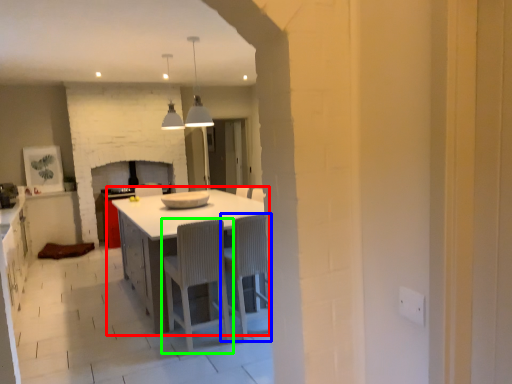
Question: Based on their relative distances, which object is nearer to table (highlighted by a red box)? Choose from chair (highlighted by a blue box) and chair (highlighted by a green box).

Choices:
 (A) chair
 (B) chair

Answer: (B)